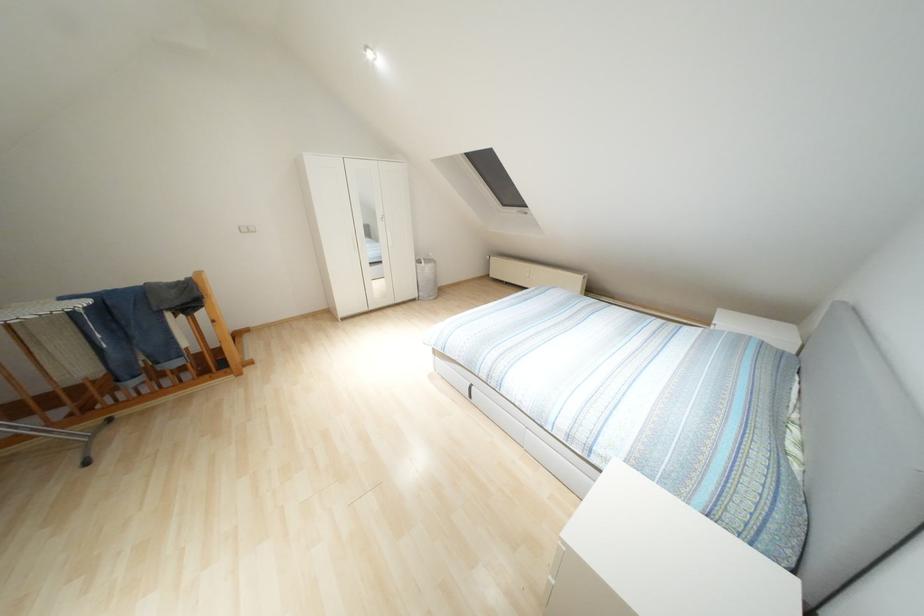
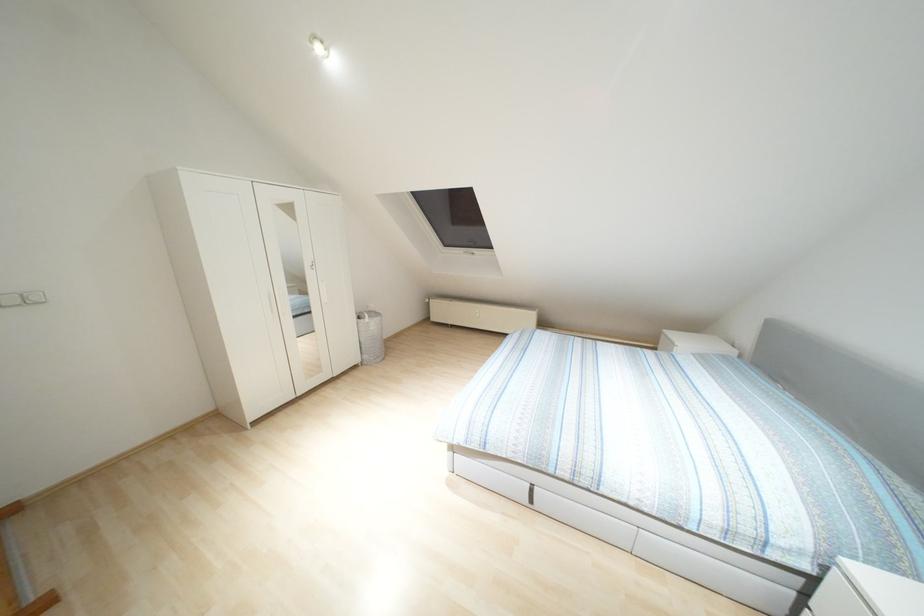
In a continuous first-person perspective shot, in which direction is the camera moving?

The cameraman moved toward left, forward.